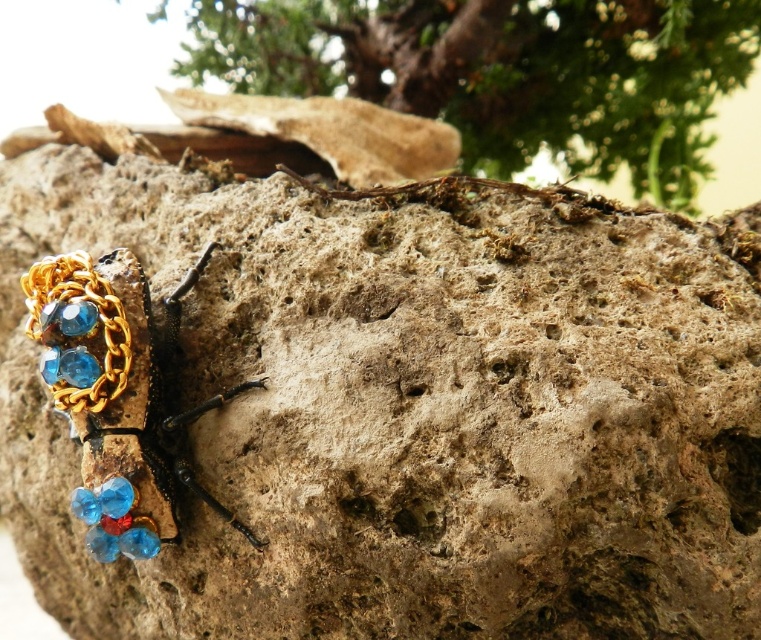
How distant is green leafy tree at upper center from gold chain and gemstone beetle at left?

green leafy tree at upper center is 27.23 inches from gold chain and gemstone beetle at left.

Between green leafy tree at upper center and gold chain and gemstone beetle at left, which one appears on the left side from the viewer's perspective?

gold chain and gemstone beetle at left is more to the left.

Is point (602, 42) positioned after point (145, 314)?

Yes, point (602, 42) is farther from viewer.

The width and height of the screenshot is (761, 640). Find the location of `green leafy tree at upper center`. green leafy tree at upper center is located at coordinates (505, 72).